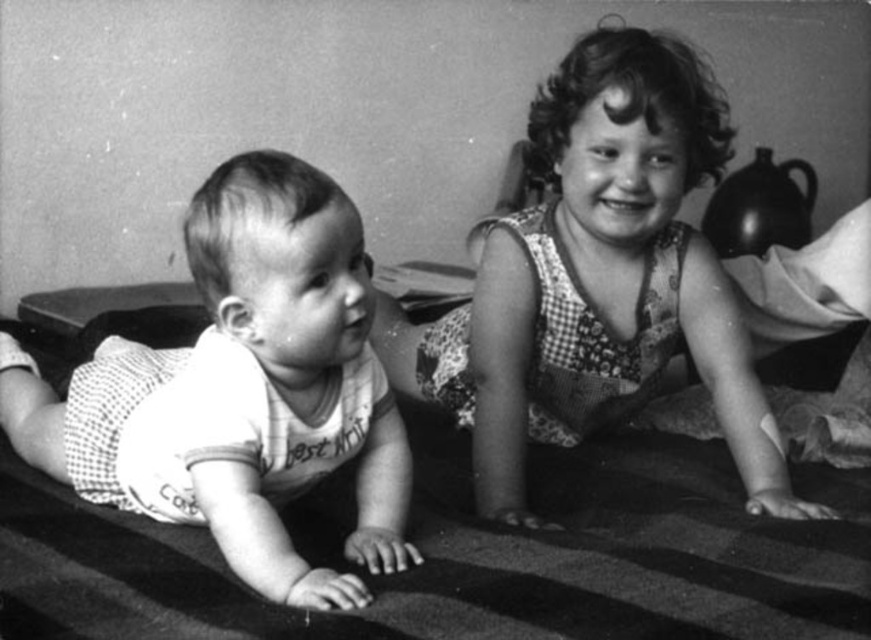
Question: Is checkered fabric dress at upper right bigger than white dotted fabric baby at left?

Choices:
 (A) yes
 (B) no

Answer: (A)

Question: Is checkered fabric dress at upper right to the left of white dotted fabric baby at left from the viewer's perspective?

Choices:
 (A) yes
 (B) no

Answer: (B)

Question: Which of the following is the closest to the observer?

Choices:
 (A) white dotted fabric baby at left
 (B) checkered fabric dress at upper right

Answer: (A)

Question: Does checkered fabric dress at upper right appear on the right side of white dotted fabric baby at left?

Choices:
 (A) yes
 (B) no

Answer: (A)